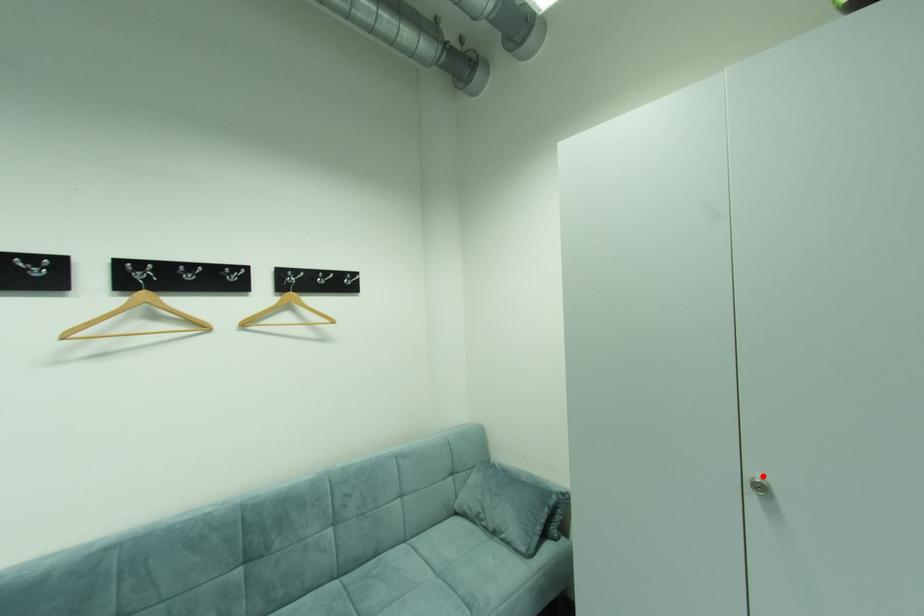
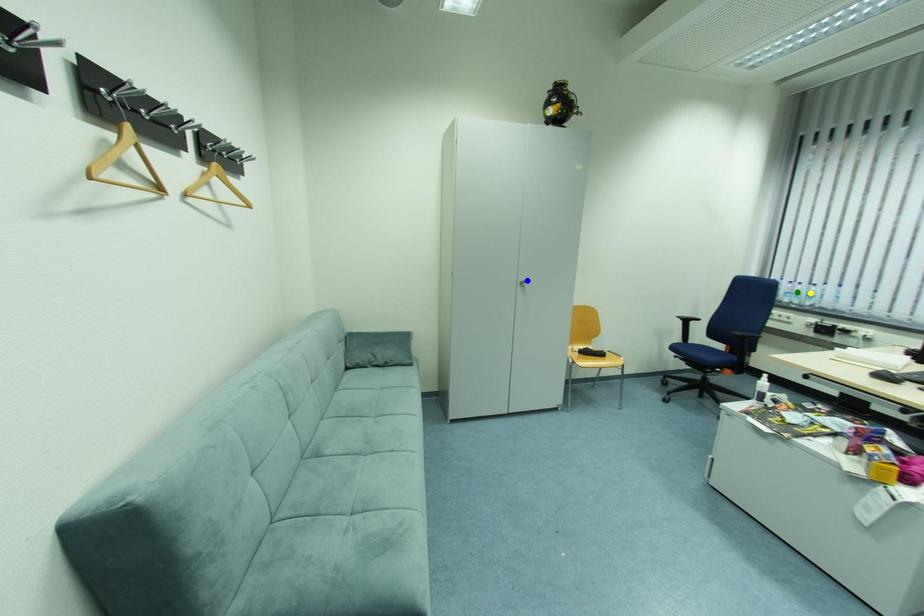
Question: I am providing you with two images of the same scene from different viewpoints. A red point is marked on the first image. You are given multiple points on the second image. Which point in image 2 is actually the same real-world point as the red point in image 1?

Choices:
 (A) blue point
 (B) green point
 (C) yellow point

Answer: (A)